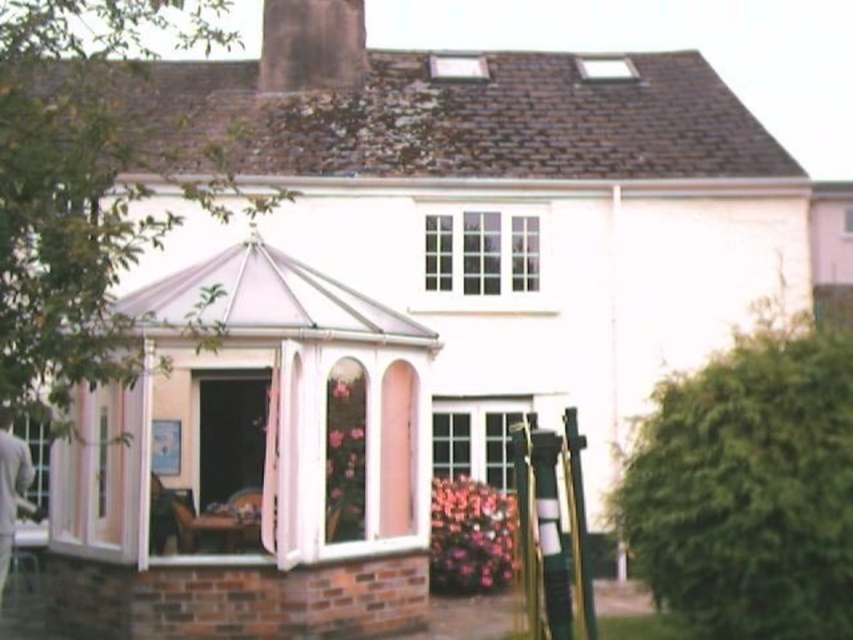
Question: Can you confirm if pink glass gazebo at left is positioned above dark gray stone chimney at upper center?

Choices:
 (A) no
 (B) yes

Answer: (A)

Question: Which point is closer to the camera?

Choices:
 (A) white glass bay window at upper center
 (B) pink glass gazebo at left
 (C) dark gray stone chimney at upper center

Answer: (B)

Question: Considering the real-world distances, which object is closest to the pink glass gazebo at left?

Choices:
 (A) dark gray stone chimney at upper center
 (B) white glass bay window at upper center

Answer: (B)

Question: Is pink glass gazebo at left to the left of white glass bay window at upper center from the viewer's perspective?

Choices:
 (A) no
 (B) yes

Answer: (B)

Question: Which of the following is the closest to the observer?

Choices:
 (A) dark gray stone chimney at upper center
 (B) white glass bay window at upper center
 (C) pink glass gazebo at left

Answer: (C)

Question: Is white glass bay window at upper center below dark gray stone chimney at upper center?

Choices:
 (A) no
 (B) yes

Answer: (B)